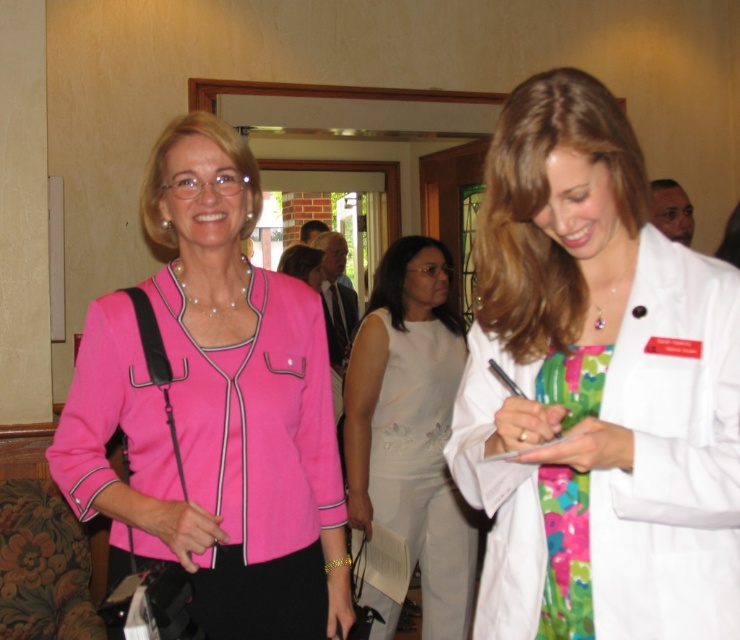
Question: Which point appears closest to the camera in this image?

Choices:
 (A) (579, 556)
 (B) (599, 353)

Answer: (A)

Question: Is white satin dress at center positioned before floral fabric dress at center?

Choices:
 (A) no
 (B) yes

Answer: (A)

Question: Which point appears closest to the camera in this image?

Choices:
 (A) (696, 504)
 (B) (406, 496)
 (C) (555, 397)
 (D) (260, 385)

Answer: (A)

Question: Is white satin dress at center further to the viewer compared to floral fabric dress at center?

Choices:
 (A) no
 (B) yes

Answer: (B)

Question: Is white matte lab coat at right to the right of floral fabric dress at center from the viewer's perspective?

Choices:
 (A) no
 (B) yes

Answer: (A)

Question: Which point is closer to the camera?

Choices:
 (A) white matte lab coat at right
 (B) pink fabric jacket at center
 (C) white satin dress at center

Answer: (A)